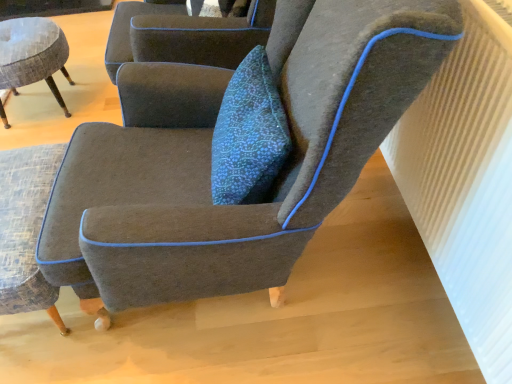
What are the coordinates of `free space that is to the left of white ribbed radiator at upper right` in the screenshot? It's located at (316, 295).